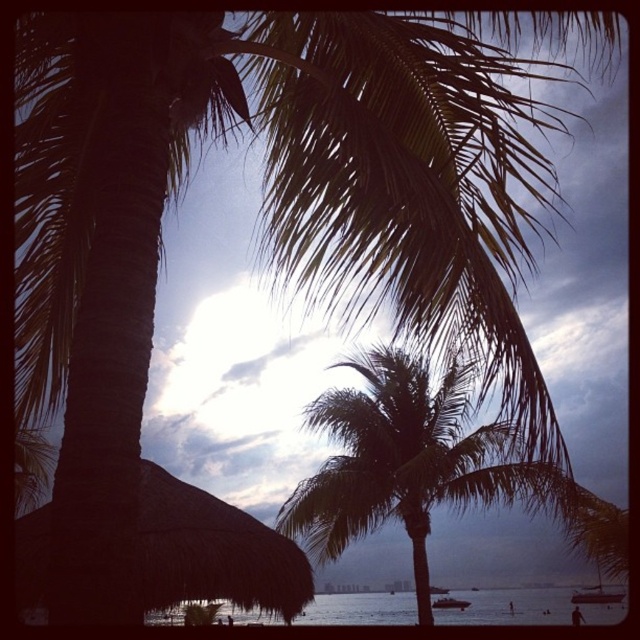
Question: Does thatched brown hut at lower left appear on the right side of white glossy boat at lower center?

Choices:
 (A) no
 (B) yes

Answer: (A)

Question: Which of the following is the farthest from the observer?

Choices:
 (A) (413, 624)
 (B) (449, 604)
 (C) (147, 556)

Answer: (B)

Question: Which point is closer to the camera?

Choices:
 (A) transparent water at lower center
 (B) thatched brown hut at lower left
 (C) dark green leafy palm tree at center

Answer: (B)

Question: Which object is the closest to the white glossy boat at lower center?

Choices:
 (A) dark green leafy palm tree at center
 (B) transparent water at lower center

Answer: (B)

Question: Does dark green leafy palm tree at center have a greater width compared to transparent water at lower center?

Choices:
 (A) yes
 (B) no

Answer: (B)

Question: Can you confirm if thatched brown hut at lower left is positioned to the right of white glossy boat at lower center?

Choices:
 (A) no
 (B) yes

Answer: (A)